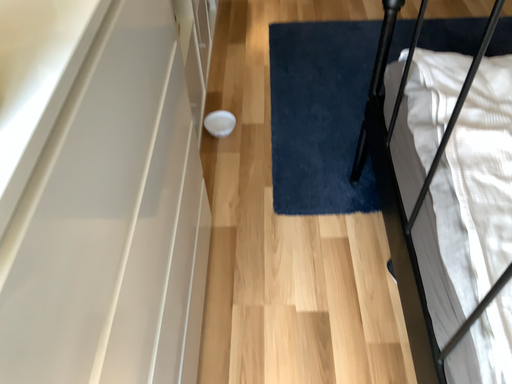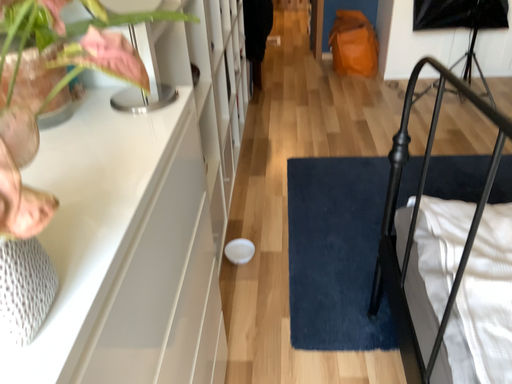
Question: Which way did the camera rotate in the video?

Choices:
 (A) rotated downward
 (B) rotated upward

Answer: (B)